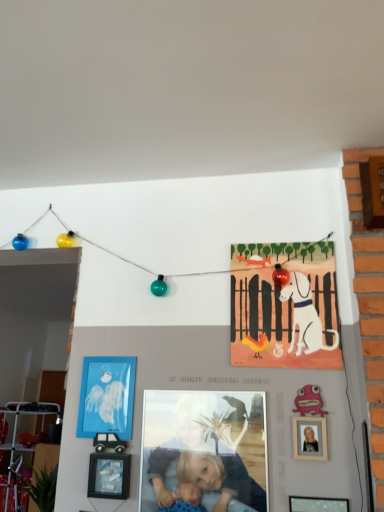
You are a GUI agent. You are given a task and a screenshot of the screen. Output one action in this format:
    pyautogui.click(x=<x>, y=<y>)
    Task: Click on the smooth skin child at center
    Image resolution: width=384 pixels, height=512 pixels.
    Given the screenshot: What is the action you would take?
    pyautogui.click(x=204, y=449)

Image resolution: width=384 pixels, height=512 pixels. Describe the element at coordinates (109, 476) in the screenshot. I see `wooden picture frame at lower center, the second picture frame when ordered from right to left` at that location.

How much space does blue paper picture frame at lower left, which appears as the third picture frame when viewed from the front, occupy horizontally?

1.29 centimeters.

At what (x,y) coordinates should I click in order to perform the action: click on matte paper poster at upper center. Please return your answer as a coordinate pair (x, y). Looking at the image, I should click on (284, 306).

Identify the location of smooth skin child at center. (204, 449).

Would you say wooden picture frame at lower center, positioned as the 2th picture frame in top-to-bottom order, is outside matte paper poster at upper center?

Yes, wooden picture frame at lower center, positioned as the 2th picture frame in top-to-bottom order, is located beyond the bounds of matte paper poster at upper center.

Consider the image. Is wooden picture frame at lower center, which appears as the second picture frame when viewed from the front, positioned with its back to matte paper poster at upper center?

wooden picture frame at lower center, which appears as the second picture frame when viewed from the front, is not turned away from matte paper poster at upper center.

Find the location of a particular element. The width and height of the screenshot is (384, 512). poster above the wooden picture frame at lower center, which ranks as the 2th picture frame in back-to-front order (from the image's perspective) is located at coordinates (284, 306).

What's the angular difference between wooden picture frame at lower center, marked as the 2th picture frame in a left-to-right arrangement, and matte paper poster at upper center's facing directions?

wooden picture frame at lower center, marked as the 2th picture frame in a left-to-right arrangement, and matte paper poster at upper center are facing 0.101 degrees away from each other.

Is wooden picture frame at lower center, which appears as the second picture frame when viewed from the front, at the left side of matte black picture frame at lower right, which is counted as the 1th picture frame, starting from the right?

Yes.

Is matte black picture frame at lower right, acting as the 1th picture frame starting from the bottom, surrounded by wooden picture frame at lower center, the second picture frame when ordered from right to left?

No, matte black picture frame at lower right, acting as the 1th picture frame starting from the bottom, is not surrounded by wooden picture frame at lower center, the second picture frame when ordered from right to left.

From a real-world perspective, which is physically above, wooden picture frame at lower center, positioned as the 2th picture frame in top-to-bottom order, or matte black picture frame at lower right, the 1th picture frame in the front-to-back sequence?

In real-world perspective, wooden picture frame at lower center, positioned as the 2th picture frame in top-to-bottom order, is above.

Which is farther, [112,493] or [320,511]?

The point [112,493] is farther.

Consider the image. Which object is more forward, wooden picture frame at lower center, which ranks as the 2th picture frame in back-to-front order, or blue paper picture frame at lower left, which is the 1th picture frame from top to bottom?

wooden picture frame at lower center, which ranks as the 2th picture frame in back-to-front order.

Which is in front, point (120, 476) or point (133, 361)?

The point (120, 476) is in front.

From the image's perspective, who appears lower, wooden picture frame at lower center, which ranks as the 2th picture frame in back-to-front order, or blue paper picture frame at lower left, which appears as the third picture frame when viewed from the front?

From the image's view, wooden picture frame at lower center, which ranks as the 2th picture frame in back-to-front order, is below.

Looking at this image, is there a large distance between wooden picture frame at lower center, which ranks as the 2th picture frame in back-to-front order, and blue paper picture frame at lower left, which is the third picture frame in bottom-to-top order?

No, wooden picture frame at lower center, which ranks as the 2th picture frame in back-to-front order, is not far away from blue paper picture frame at lower left, which is the third picture frame in bottom-to-top order.

Which is farther from the camera, (87, 402) or (93, 458)?

Point (87, 402)

Is blue paper picture frame at lower left, which is the 1th picture frame from top to bottom, to the left of wooden picture frame at lower center, positioned as the 2th picture frame in top-to-bottom order, from the viewer's perspective?

Yes.

In the scene shown: From a real-world perspective, which object stands above the other?

blue paper picture frame at lower left, arranged as the first picture frame when viewed from the back.

At what (x,y) coordinates should I click in order to perform the action: click on picture frame that is on the left side of wooden picture frame at lower center, which appears as the second picture frame when viewed from the front. Please return your answer as a coordinate pair (x, y). Looking at the image, I should click on (107, 397).

Looking at the image, does blue paper picture frame at lower left, which ranks as the 3th picture frame in right-to-left order, seem bigger or smaller compared to smooth skin child at center?

In the image, blue paper picture frame at lower left, which ranks as the 3th picture frame in right-to-left order, appears to be smaller than smooth skin child at center.

In terms of height, does blue paper picture frame at lower left, which is the third picture frame in bottom-to-top order, look taller or shorter compared to smooth skin child at center?

Considering their sizes, blue paper picture frame at lower left, which is the third picture frame in bottom-to-top order, has less height than smooth skin child at center.

Based on the photo, which object is closer to the camera taking this photo, blue paper picture frame at lower left, the 1th picture frame in the left-to-right sequence, or smooth skin child at center?

smooth skin child at center.

Would you consider matte black picture frame at lower right, which ranks as the 3th picture frame in left-to-right order, to be distant from matte paper poster at upper center?

matte black picture frame at lower right, which ranks as the 3th picture frame in left-to-right order, is actually quite close to matte paper poster at upper center.

Is matte paper poster at upper center located within matte black picture frame at lower right, the 1th picture frame in the front-to-back sequence?

No, matte paper poster at upper center is not a part of matte black picture frame at lower right, the 1th picture frame in the front-to-back sequence.

Who is taller, matte black picture frame at lower right, which is counted as the 1th picture frame, starting from the right, or matte paper poster at upper center?

Standing taller between the two is matte paper poster at upper center.

Is point (340, 500) positioned before point (246, 297)?

Yes, it is in front of point (246, 297).

Is matte black picture frame at lower right, which is counted as the 1th picture frame, starting from the right, wider than blue paper picture frame at lower left, which appears as the third picture frame when viewed from the front?

Indeed, matte black picture frame at lower right, which is counted as the 1th picture frame, starting from the right, has a greater width compared to blue paper picture frame at lower left, which appears as the third picture frame when viewed from the front.

Could you tell me if matte black picture frame at lower right, which is counted as the 1th picture frame, starting from the right, is facing blue paper picture frame at lower left, which appears as the third picture frame when viewed from the front?

No, matte black picture frame at lower right, which is counted as the 1th picture frame, starting from the right, is not aimed at blue paper picture frame at lower left, which appears as the third picture frame when viewed from the front.

Can you tell me how much matte black picture frame at lower right, which ranks as the 3th picture frame in left-to-right order, and blue paper picture frame at lower left, arranged as the first picture frame when viewed from the back, differ in facing direction?

0.386 degrees.

At what (x,y) coordinates should I click in order to perform the action: click on picture frame that is the 2nd one when counting downward from the blue paper picture frame at lower left, which ranks as the 3th picture frame in right-to-left order (from the image's perspective). Please return your answer as a coordinate pair (x, y). Image resolution: width=384 pixels, height=512 pixels. Looking at the image, I should click on (317, 504).

Identify the location of the 1st picture frame to the left of the matte paper poster at upper center, counting from the anchor's position. Image resolution: width=384 pixels, height=512 pixels. (109, 476).

Where is `picture frame on the right of the wooden picture frame at lower center, positioned as the 2th picture frame in top-to-bottom order`? picture frame on the right of the wooden picture frame at lower center, positioned as the 2th picture frame in top-to-bottom order is located at coordinates (317, 504).

Looking at the image, which one is located further to smooth skin child at center, wooden picture frame at lower center, marked as the 2th picture frame in a left-to-right arrangement, or matte black picture frame at lower right, which is the third picture frame in back-to-front order?

The object further to smooth skin child at center is matte black picture frame at lower right, which is the third picture frame in back-to-front order.

Estimate the real-world distances between objects in this image. Which object is closer to matte paper poster at upper center, blue paper picture frame at lower left, which ranks as the 3th picture frame in right-to-left order, or matte black picture frame at lower right, acting as the 1th picture frame starting from the bottom?

blue paper picture frame at lower left, which ranks as the 3th picture frame in right-to-left order, lies closer to matte paper poster at upper center than the other object.

Considering their positions, is matte paper poster at upper center positioned further to blue paper picture frame at lower left, which appears as the third picture frame when viewed from the front, than matte black picture frame at lower right, acting as the 1th picture frame starting from the bottom?

matte black picture frame at lower right, acting as the 1th picture frame starting from the bottom, is positioned further to the anchor blue paper picture frame at lower left, which appears as the third picture frame when viewed from the front.

From the image, which object appears to be nearer to wooden picture frame at lower center, which ranks as the 2th picture frame in back-to-front order, matte black picture frame at lower right, which is counted as the 1th picture frame, starting from the right, or blue paper picture frame at lower left, which is the third picture frame in bottom-to-top order?

The object closer to wooden picture frame at lower center, which ranks as the 2th picture frame in back-to-front order, is blue paper picture frame at lower left, which is the third picture frame in bottom-to-top order.

Estimate the real-world distances between objects in this image. Which object is further from matte paper poster at upper center, matte black picture frame at lower right, which ranks as the 3th picture frame in left-to-right order, or smooth skin child at center?

matte black picture frame at lower right, which ranks as the 3th picture frame in left-to-right order, is positioned further to the anchor matte paper poster at upper center.

Looking at the image, which one is located closer to blue paper picture frame at lower left, which appears as the third picture frame when viewed from the front, wooden picture frame at lower center, which appears as the second picture frame when viewed from the front, or matte black picture frame at lower right, which is the third picture frame in back-to-front order?

wooden picture frame at lower center, which appears as the second picture frame when viewed from the front.

Looking at the image, which one is located further to blue paper picture frame at lower left, arranged as the first picture frame when viewed from the back, wooden picture frame at lower center, positioned as the 2th picture frame in top-to-bottom order, or matte paper poster at upper center?

matte paper poster at upper center.

Considering their positions, is matte paper poster at upper center positioned further to matte black picture frame at lower right, which ranks as the 3th picture frame in left-to-right order, than smooth skin child at center?

matte paper poster at upper center is further to matte black picture frame at lower right, which ranks as the 3th picture frame in left-to-right order.

This screenshot has width=384, height=512. Find the location of `person between blue paper picture frame at lower left, which appears as the third picture frame when viewed from the front, and matte paper poster at upper center from left to right`. person between blue paper picture frame at lower left, which appears as the third picture frame when viewed from the front, and matte paper poster at upper center from left to right is located at coordinates (204, 449).

I want to click on poster situated between blue paper picture frame at lower left, arranged as the first picture frame when viewed from the back, and matte black picture frame at lower right, which ranks as the 3th picture frame in left-to-right order, from left to right, so click(x=284, y=306).

At what (x,y) coordinates should I click in order to perform the action: click on person located between wooden picture frame at lower center, which appears as the second picture frame when viewed from the front, and matte paper poster at upper center in the left-right direction. Please return your answer as a coordinate pair (x, y). The width and height of the screenshot is (384, 512). Looking at the image, I should click on (204, 449).

Locate an element on the screen. The image size is (384, 512). person between blue paper picture frame at lower left, which ranks as the 3th picture frame in right-to-left order, and matte black picture frame at lower right, which ranks as the 3th picture frame in left-to-right order, from left to right is located at coordinates (204, 449).